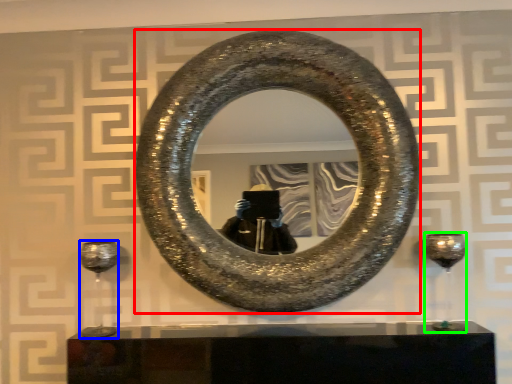
Question: Estimate the real-world distances between objects in this image. Which object is closer to horseshoe (highlighted by a red box), wine glass (highlighted by a blue box) or wine glass (highlighted by a green box)?

Choices:
 (A) wine glass
 (B) wine glass

Answer: (B)